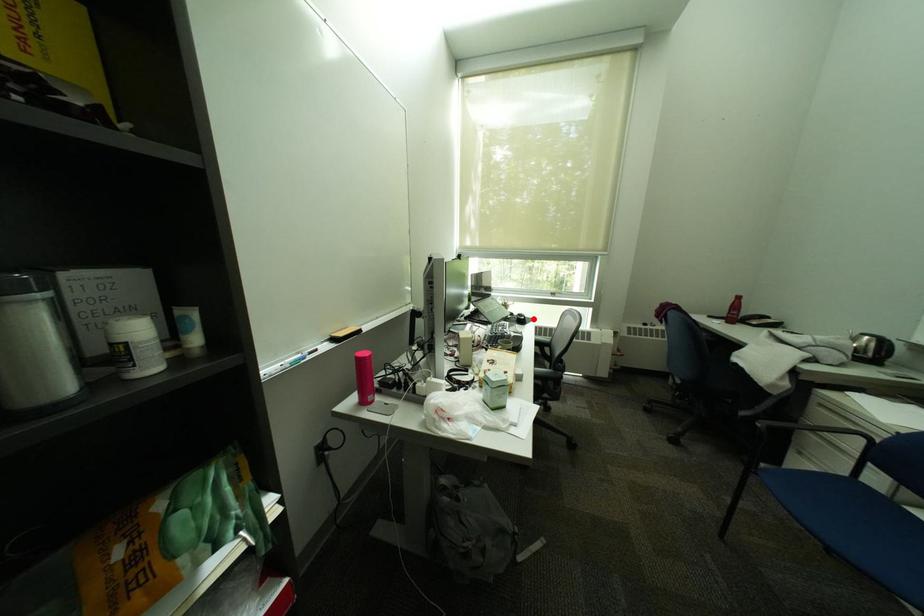
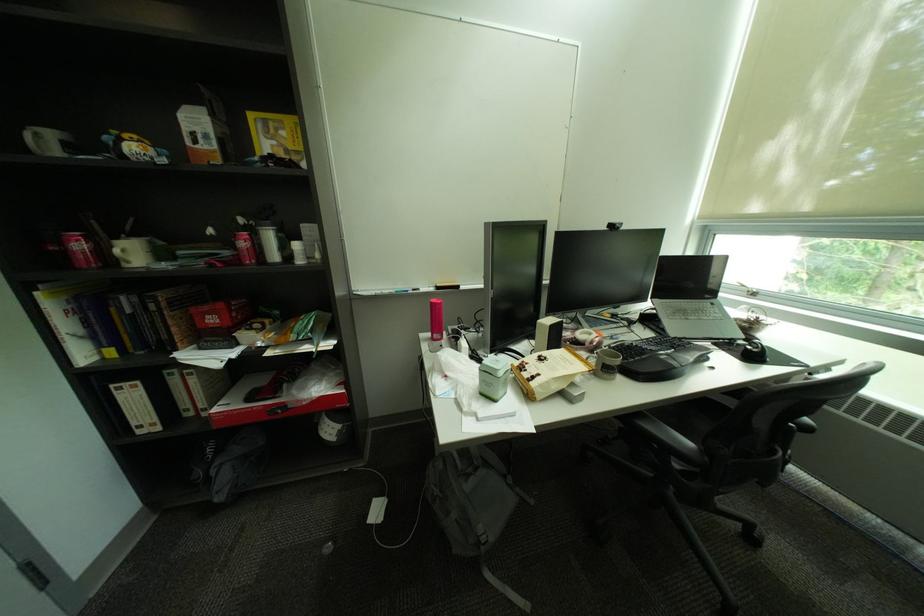
Where in the second image is the point corresponding to the highlighted location from the first image?

(766, 352)